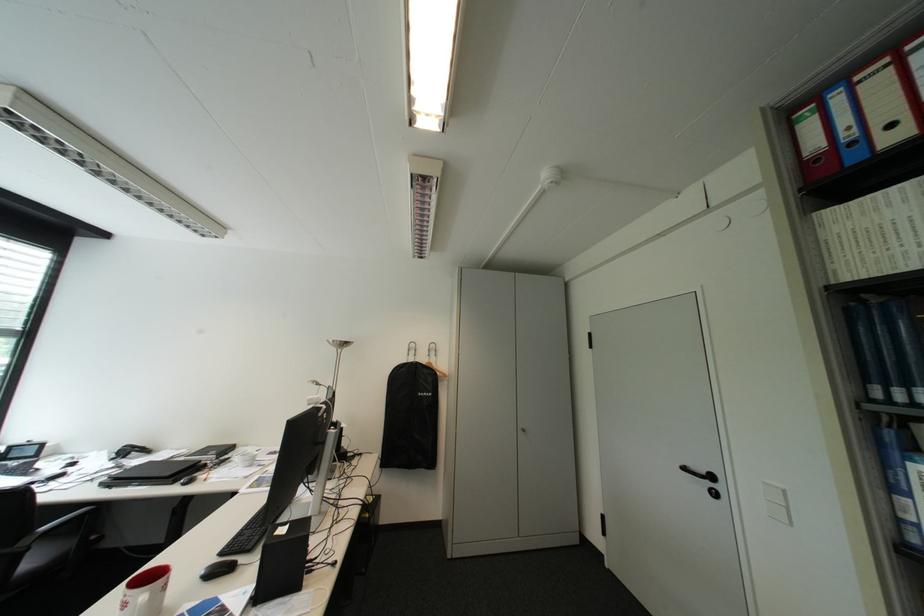
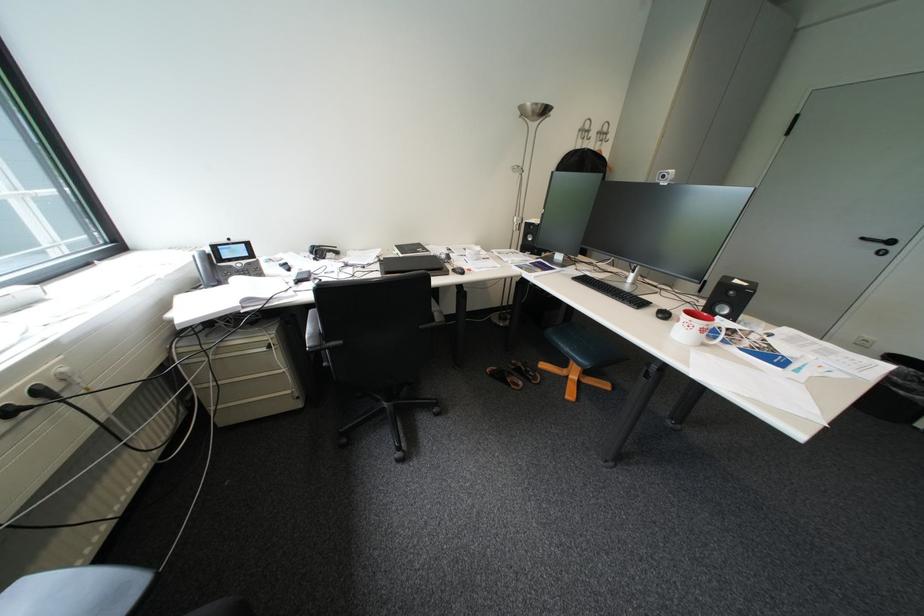
In the second image, find the point that corresponds to the point at 138,452 in the first image.

(331, 253)